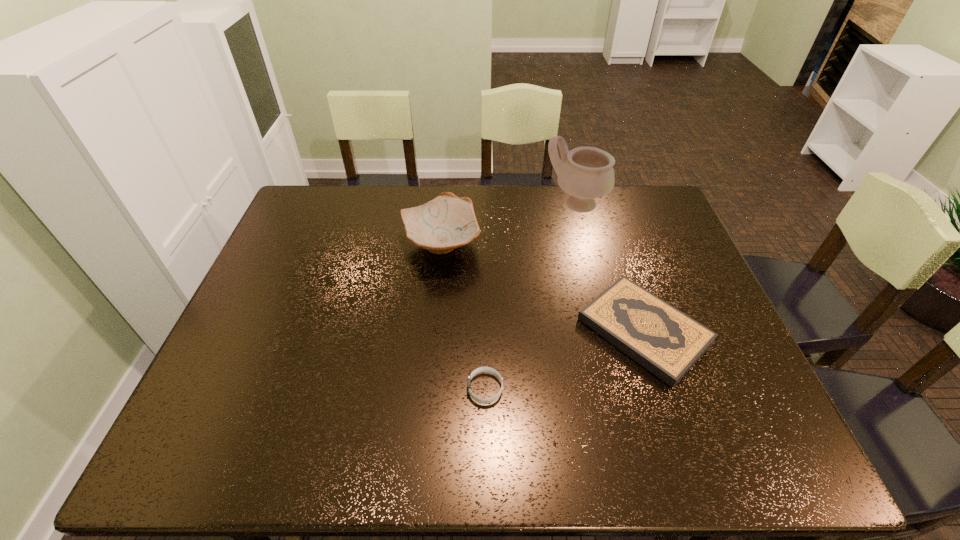
The width and height of the screenshot is (960, 540). In order to click on empty space that is in between the wristband and the hardback book in this screenshot , I will do `click(564, 360)`.

At what (x,y) coordinates should I click in order to perform the action: click on vacant point located between the hardback book and the right pottery. Please return your answer as a coordinate pair (x, y). Looking at the image, I should click on [x=610, y=267].

At what (x,y) coordinates should I click in order to perform the action: click on free space that is in between the wristband and the hardback book. Please return your answer as a coordinate pair (x, y). Looking at the image, I should click on (564, 360).

You are a GUI agent. You are given a task and a screenshot of the screen. Output one action in this format:
    pyautogui.click(x=<x>, y=<y>)
    Task: Click on the free space that is in between the taller pottery and the wristband
    The width and height of the screenshot is (960, 540).
    Given the screenshot: What is the action you would take?
    pyautogui.click(x=531, y=296)

Identify the location of empty location between the tallest object and the wristband. The height and width of the screenshot is (540, 960). (531, 296).

At what (x,y) coordinates should I click in order to perform the action: click on empty location between the taller pottery and the left pottery. Please return your answer as a coordinate pair (x, y). The image size is (960, 540). Looking at the image, I should click on (509, 224).

At what (x,y) coordinates should I click in order to perform the action: click on vacant space in between the hardback book and the right pottery. Please return your answer as a coordinate pair (x, y). Looking at the image, I should click on (610, 267).

Identify the location of vacant area that lies between the wristband and the hardback book. Image resolution: width=960 pixels, height=540 pixels. (564, 360).

The width and height of the screenshot is (960, 540). In order to click on vacant point located between the hardback book and the second tallest object in this screenshot , I will do `click(542, 288)`.

Select which object appears as the second closest to the wristband. Please provide its 2D coordinates. Your answer should be formatted as a tuple, i.e. [(x, y)], where the tuple contains the x and y coordinates of a point satisfying the conditions above.

[(447, 222)]